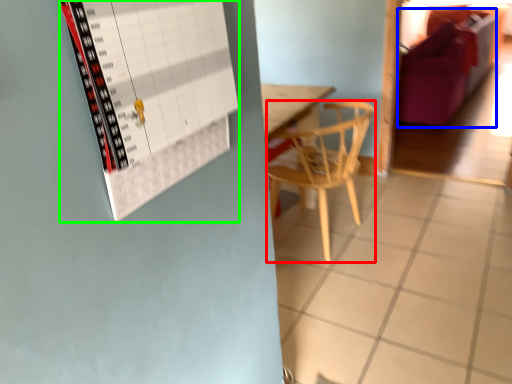
Question: Estimate the real-world distances between objects in this image. Which object is closer to chair (highlighted by a red box), couch (highlighted by a blue box) or bulletin board (highlighted by a green box)?

Choices:
 (A) couch
 (B) bulletin board

Answer: (B)